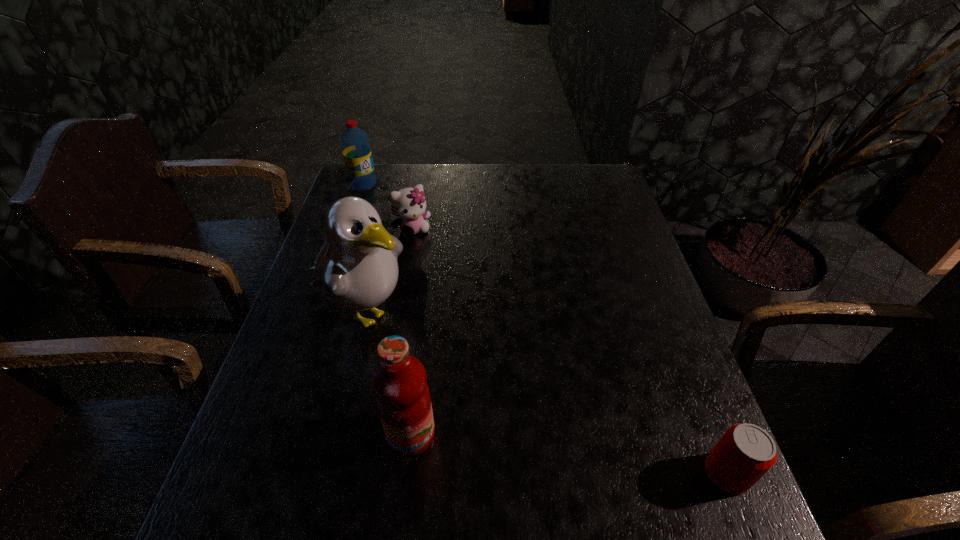
Find the location of a particular element. free space on the desktop that is between the fourth shortest object and the rightmost object and is positioned on the beak of the third nearest object is located at coordinates (564, 453).

The image size is (960, 540). In order to click on free space on the desktop that is between the fruit juice and the shortest object and is positioned on the front-facing side of the kitten in this screenshot , I will do `click(572, 454)`.

You are a GUI agent. You are given a task and a screenshot of the screen. Output one action in this format:
    pyautogui.click(x=<x>, y=<y>)
    Task: Click on the free space on the desktop that is between the fruit juice and the shortest object and is positioned on the front label of the third shortest object
    The height and width of the screenshot is (540, 960).
    Given the screenshot: What is the action you would take?
    pyautogui.click(x=584, y=456)